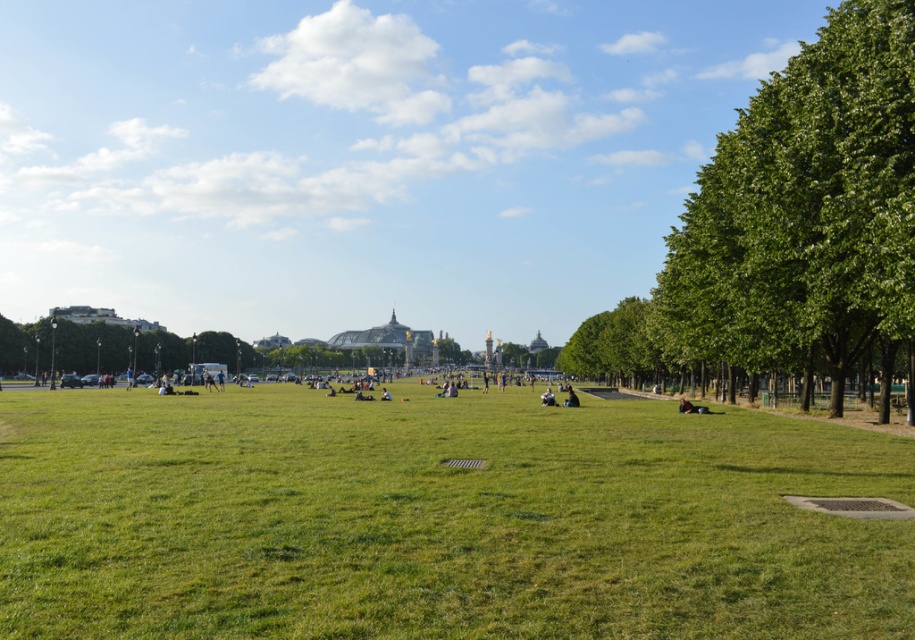
Question: Which point is farther from the camera taking this photo?

Choices:
 (A) (122, 497)
 (B) (720, 349)

Answer: (B)

Question: Which point is farther to the camera?

Choices:
 (A) green grassy field at center
 (B) green leafy tree at right

Answer: (B)

Question: Is green grassy field at center positioned in front of green leafy tree at right?

Choices:
 (A) no
 (B) yes

Answer: (B)

Question: Can you confirm if green grassy field at center is wider than green leafy tree at right?

Choices:
 (A) yes
 (B) no

Answer: (A)

Question: Is green grassy field at center below green leafy tree at right?

Choices:
 (A) no
 (B) yes

Answer: (B)

Question: Which point appears closest to the camera in this image?

Choices:
 (A) (725, 170)
 (B) (885, 461)

Answer: (B)